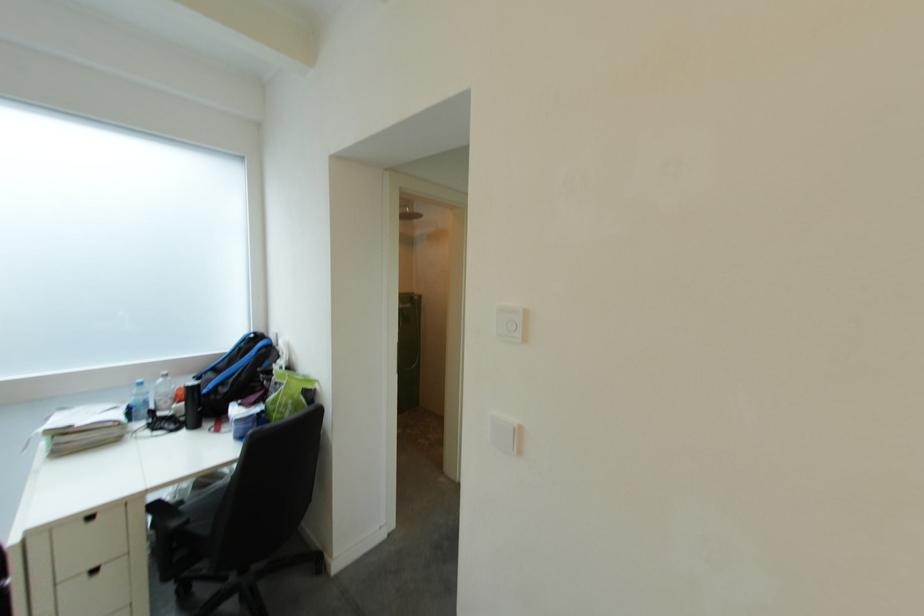
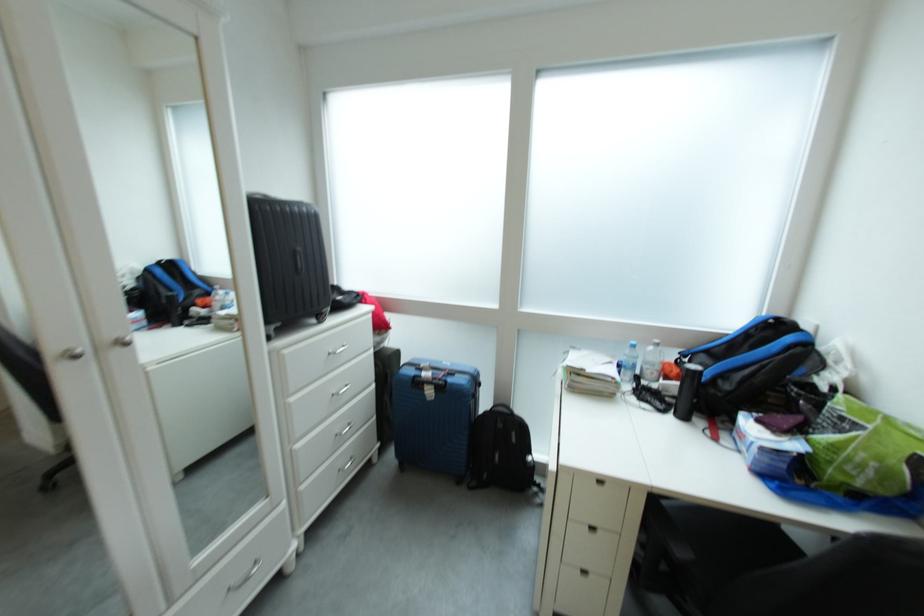
Where in the second image is the point corresponding to point 163,410 from the first image?

(650, 376)